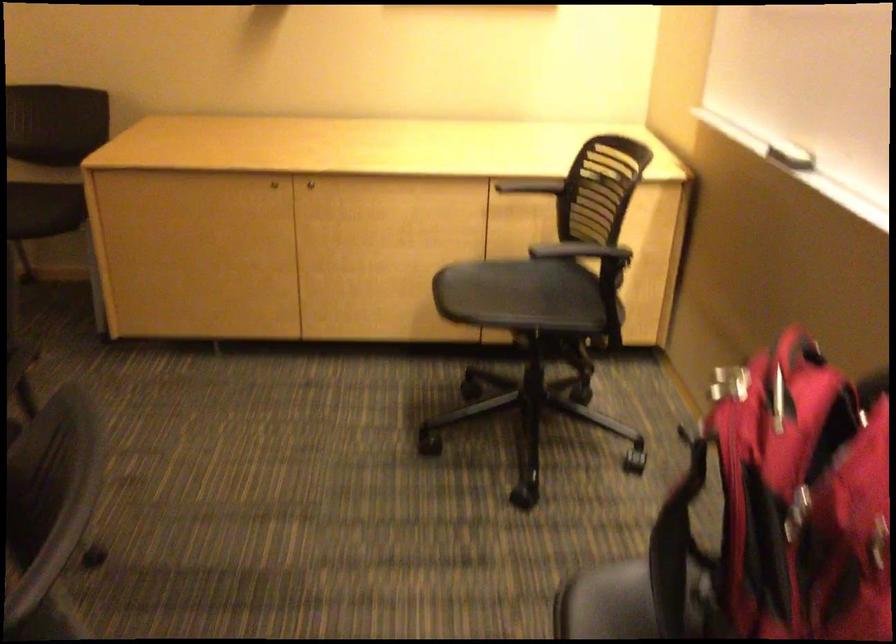
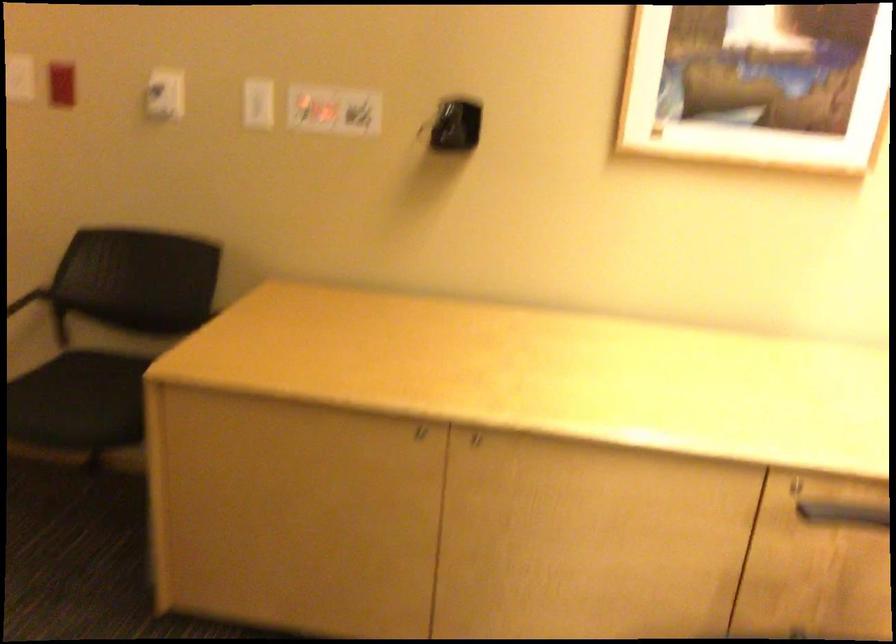
In the second image, find the point that corresponds to [255,187] in the first image.

(410, 433)